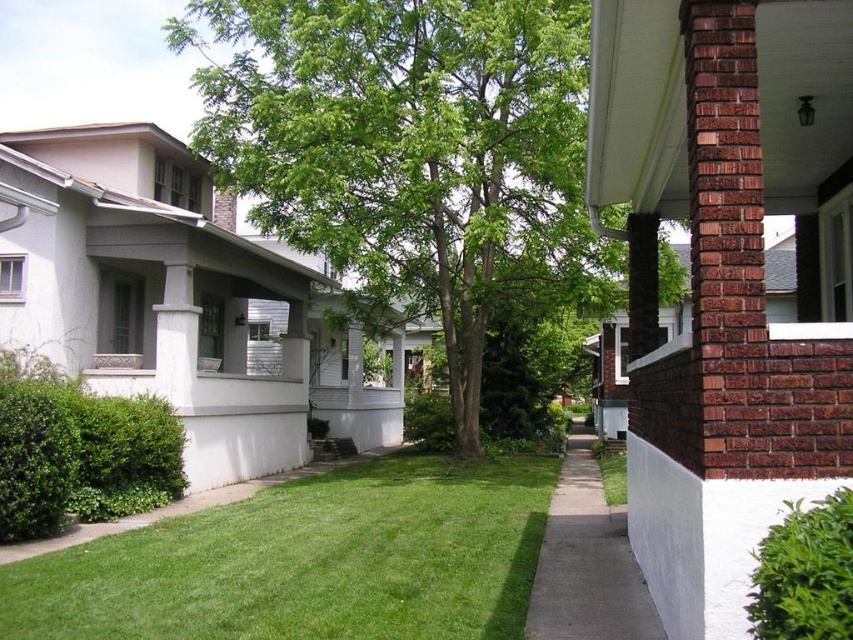
You are standing on the sidewalk in the suburban neighborhood scene. You see the green leafy tree at center and the green grass at lower center. Which object is closer to you?

The green leafy tree at center is closer to you because it is further to the viewer than the green grass at lower center.

You are standing on the gray concrete sidewalk at lower center and want to walk towards the green leafy tree at center. Which direction should you move to reach it?

Since the gray concrete sidewalk at lower center is behind the green leafy tree at center, you should move forward towards the tree to reach it.

You are a gardener who wants to plant a new flower bed. You have a 1.5 square meter flower bed plan. Which area between the green grass at lower center and the gray concrete sidewalk at lower center is more suitable for the flower bed?

The green grass at lower center has a smaller size compared to the gray concrete sidewalk at lower center, so the gray concrete sidewalk at lower center is more suitable for the flower bed since it has more space available.